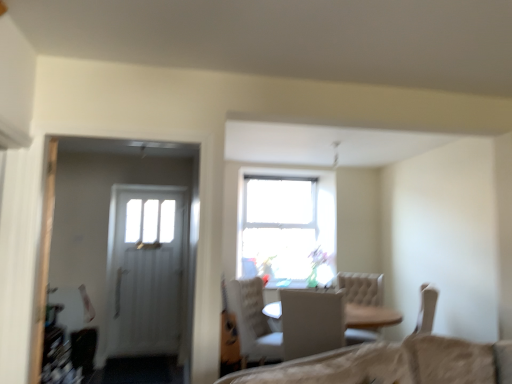
Question: Is white textured chair at center, positioned as the first chair in back-to-front order, outside white fabric chair at center, the 1th chair when ordered from front to back?

Choices:
 (A) no
 (B) yes

Answer: (B)

Question: Could you tell me if white textured chair at center, positioned as the first chair in back-to-front order, is facing white fabric chair at center, the 1th chair when ordered from front to back?

Choices:
 (A) no
 (B) yes

Answer: (A)

Question: Is white textured chair at center, the 2th chair viewed from the front, thinner than white fabric chair at center, the 1th chair when ordered from front to back?

Choices:
 (A) yes
 (B) no

Answer: (A)

Question: Is white textured chair at center, the 2th chair viewed from the front, turned away from white fabric chair at center, the 1th chair when ordered from front to back?

Choices:
 (A) yes
 (B) no

Answer: (B)

Question: Is white textured chair at center, positioned as the first chair in back-to-front order, beside white fabric chair at center, which ranks as the 2th chair in back-to-front order?

Choices:
 (A) yes
 (B) no

Answer: (B)

Question: From a real-world perspective, is white textured chair at center, positioned as the first chair in back-to-front order, positioned under white fabric chair at center, the 1th chair when ordered from front to back, based on gravity?

Choices:
 (A) no
 (B) yes

Answer: (B)

Question: From a real-world perspective, is white fabric chair at center, the 1th chair when ordered from front to back, beneath white textured chair at center, the 2th chair viewed from the front?

Choices:
 (A) yes
 (B) no

Answer: (B)

Question: Is white fabric chair at center, the 1th chair when ordered from front to back, taller than white textured chair at center, the 2th chair viewed from the front?

Choices:
 (A) no
 (B) yes

Answer: (A)

Question: Considering the relative sizes of white fabric chair at center, the 1th chair when ordered from front to back, and white textured chair at center, positioned as the first chair in back-to-front order, in the image provided, is white fabric chair at center, the 1th chair when ordered from front to back, thinner than white textured chair at center, positioned as the first chair in back-to-front order,?

Choices:
 (A) yes
 (B) no

Answer: (B)

Question: Is white fabric chair at center, the 1th chair when ordered from front to back, bigger than white textured chair at center, the 2th chair viewed from the front?

Choices:
 (A) no
 (B) yes

Answer: (A)

Question: Is white textured chair at center, positioned as the first chair in back-to-front order, completely or partially inside white fabric chair at center, which ranks as the 2th chair in back-to-front order?

Choices:
 (A) no
 (B) yes

Answer: (A)

Question: Considering the relative sizes of white fabric chair at center, which ranks as the 2th chair in back-to-front order, and white textured chair at center, the 2th chair viewed from the front, in the image provided, is white fabric chair at center, which ranks as the 2th chair in back-to-front order, shorter than white textured chair at center, the 2th chair viewed from the front,?

Choices:
 (A) yes
 (B) no

Answer: (A)

Question: In the image, is white fabric chair at center, the 1th chair when ordered from front to back, positioned in front of or behind white textured chair at center, the 2th chair viewed from the front?

Choices:
 (A) front
 (B) behind

Answer: (A)